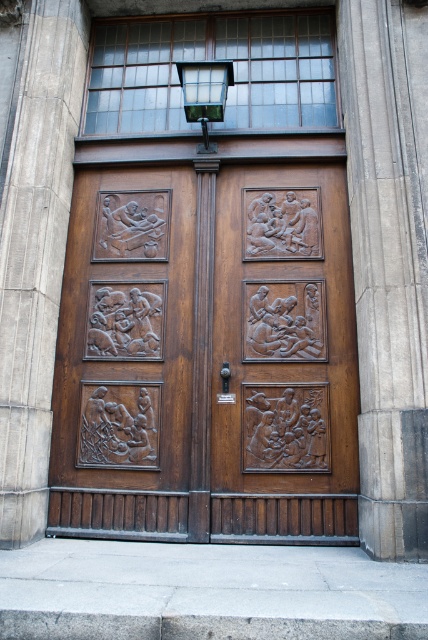
From the picture: Can you confirm if matte wood door at center is bigger than smooth stone pillar at left?

Correct, matte wood door at center is larger in size than smooth stone pillar at left.

Does matte wood door at center have a smaller size compared to smooth stone pillar at left?

Incorrect, matte wood door at center is not smaller in size than smooth stone pillar at left.

Between point (258, 493) and point (20, 493), which one is positioned behind?

Positioned behind is point (258, 493).

Image resolution: width=428 pixels, height=640 pixels. Identify the location of matte wood door at center. (207, 356).

Between point (350, 477) and point (44, 118), which one is positioned behind?

Positioned behind is point (44, 118).

Who is more distant from viewer, [279,492] or [48,141]?

Positioned behind is point [48,141].

Locate an element on the screen. The height and width of the screenshot is (640, 428). polished wood carving at center is located at coordinates (282, 358).

Based on the photo, who is higher up, gray stone pillar at center or smooth stone pillar at left?

smooth stone pillar at left

Which of these two, gray stone pillar at center or smooth stone pillar at left, stands shorter?

With less height is gray stone pillar at center.

Is point (374, 99) closer to viewer compared to point (8, 547)?

That is False.

Where is `gray stone pillar at center`? The width and height of the screenshot is (428, 640). gray stone pillar at center is located at coordinates (388, 262).